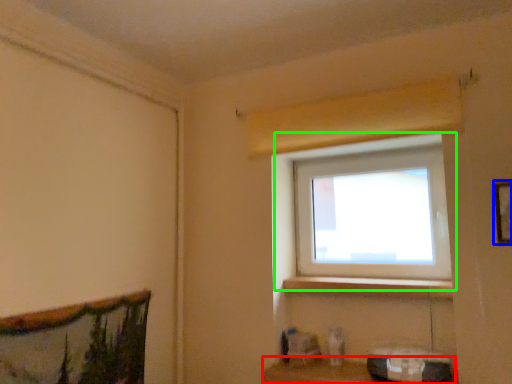
Question: Based on their relative distances, which object is nearer to shelf (highlighted by a red box)? Choose from picture frame (highlighted by a blue box) and window (highlighted by a green box).

Choices:
 (A) picture frame
 (B) window

Answer: (B)